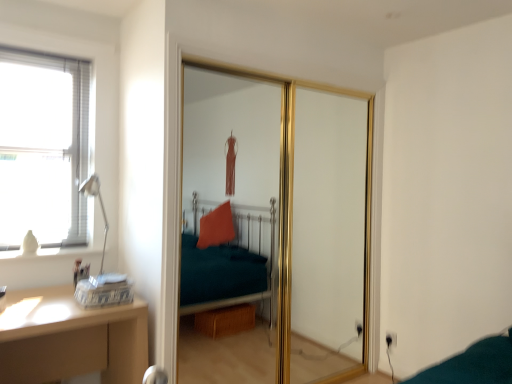
Question: Considering the relative sizes of gold metallic sliding door at center and wooden desk at lower left in the image provided, is gold metallic sliding door at center thinner than wooden desk at lower left?

Choices:
 (A) no
 (B) yes

Answer: (B)

Question: Could wooden desk at lower left be considered to be inside gold metallic sliding door at center?

Choices:
 (A) yes
 (B) no

Answer: (B)

Question: Does gold metallic sliding door at center have a smaller size compared to wooden desk at lower left?

Choices:
 (A) no
 (B) yes

Answer: (A)

Question: Is gold metallic sliding door at center aimed at wooden desk at lower left?

Choices:
 (A) yes
 (B) no

Answer: (B)

Question: From the image's perspective, is gold metallic sliding door at center on wooden desk at lower left?

Choices:
 (A) no
 (B) yes

Answer: (B)

Question: Does point (264, 236) appear closer or farther from the camera than point (29, 291)?

Choices:
 (A) closer
 (B) farther

Answer: (B)

Question: Is gold metallic sliding door at center in front of or behind wooden desk at lower left in the image?

Choices:
 (A) front
 (B) behind

Answer: (B)

Question: In terms of width, does gold metallic sliding door at center look wider or thinner when compared to wooden desk at lower left?

Choices:
 (A) thin
 (B) wide

Answer: (A)

Question: Would you say gold metallic sliding door at center is to the left or to the right of wooden desk at lower left in the picture?

Choices:
 (A) right
 (B) left

Answer: (A)

Question: Does point (98, 193) appear closer or farther from the camera than point (19, 377)?

Choices:
 (A) closer
 (B) farther

Answer: (B)

Question: Would you say matte silver table lamp at left is to the left or to the right of wooden desk at lower left in the picture?

Choices:
 (A) right
 (B) left

Answer: (A)

Question: From the image's perspective, is matte silver table lamp at left located above or below wooden desk at lower left?

Choices:
 (A) below
 (B) above

Answer: (B)

Question: Looking at their shapes, would you say matte silver table lamp at left is wider or thinner than wooden desk at lower left?

Choices:
 (A) thin
 (B) wide

Answer: (A)

Question: In the image, is wooden desk at lower left on the left side or the right side of matte silver table lamp at left?

Choices:
 (A) right
 (B) left

Answer: (B)

Question: Is wooden desk at lower left bigger or smaller than matte silver table lamp at left?

Choices:
 (A) big
 (B) small

Answer: (A)